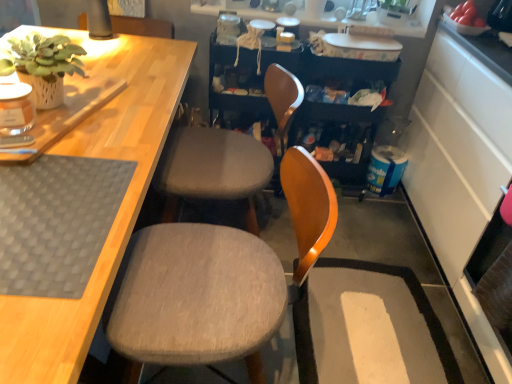
Question: From the image's perspective, would you say green matte plant at upper left is shown under white glossy shelves at upper center?

Choices:
 (A) no
 (B) yes

Answer: (B)

Question: Can we say green matte plant at upper left lies outside white glossy shelves at upper center?

Choices:
 (A) yes
 (B) no

Answer: (A)

Question: Is green matte plant at upper left oriented away from white glossy shelves at upper center?

Choices:
 (A) yes
 (B) no

Answer: (B)

Question: Is green matte plant at upper left taller than white glossy shelves at upper center?

Choices:
 (A) no
 (B) yes

Answer: (B)

Question: Considering the relative sizes of green matte plant at upper left and white glossy shelves at upper center in the image provided, is green matte plant at upper left shorter than white glossy shelves at upper center?

Choices:
 (A) yes
 (B) no

Answer: (B)

Question: From a real-world perspective, is green matte plant at upper left above or below white glossy shelves at upper center?

Choices:
 (A) below
 (B) above

Answer: (B)

Question: Is green matte plant at upper left inside the boundaries of white glossy shelves at upper center, or outside?

Choices:
 (A) inside
 (B) outside

Answer: (B)

Question: Considering the positions of green matte plant at upper left and white glossy shelves at upper center in the image, is green matte plant at upper left bigger or smaller than white glossy shelves at upper center?

Choices:
 (A) big
 (B) small

Answer: (B)

Question: From the image's perspective, is green matte plant at upper left positioned above or below white glossy shelves at upper center?

Choices:
 (A) above
 (B) below

Answer: (B)

Question: Looking at their shapes, would you say textured gray cushion at center, the 2th chair positioned from the front, is wider or thinner than white textured rug at lower right?

Choices:
 (A) thin
 (B) wide

Answer: (A)

Question: Considering the relative positions of textured gray cushion at center, the 2th chair positioned from the front, and white textured rug at lower right in the image provided, is textured gray cushion at center, the 2th chair positioned from the front, to the left or to the right of white textured rug at lower right?

Choices:
 (A) left
 (B) right

Answer: (A)

Question: Is textured gray cushion at center, the first chair when ordered from back to front, inside the boundaries of white textured rug at lower right, or outside?

Choices:
 (A) outside
 (B) inside

Answer: (A)

Question: Is textured gray cushion at center, the 2th chair positioned from the front, bigger or smaller than white textured rug at lower right?

Choices:
 (A) big
 (B) small

Answer: (A)

Question: Relative to gray fabric chair at center, the first chair in the front-to-back sequence, is textured gray cushion at center, the 2th chair positioned from the front, in front or behind?

Choices:
 (A) front
 (B) behind

Answer: (B)

Question: In terms of width, does textured gray cushion at center, the first chair when ordered from back to front, look wider or thinner when compared to gray fabric chair at center, which ranks as the 2th chair in back-to-front order?

Choices:
 (A) wide
 (B) thin

Answer: (B)